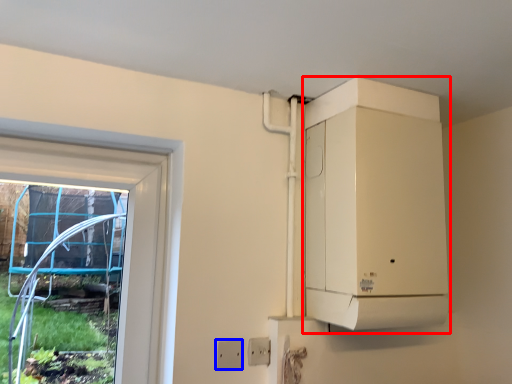
Question: Among these objects, which one is nearest to the camera, appliance (highlighted by a red box) or electric outlet (highlighted by a blue box)?

Choices:
 (A) appliance
 (B) electric outlet

Answer: (A)